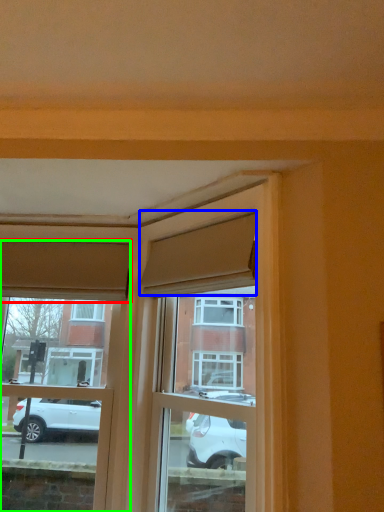
Question: Which object is positioned farthest from curtain (highlighted by a red box)? Select from curtain (highlighted by a blue box) and window (highlighted by a green box).

Choices:
 (A) curtain
 (B) window

Answer: (A)